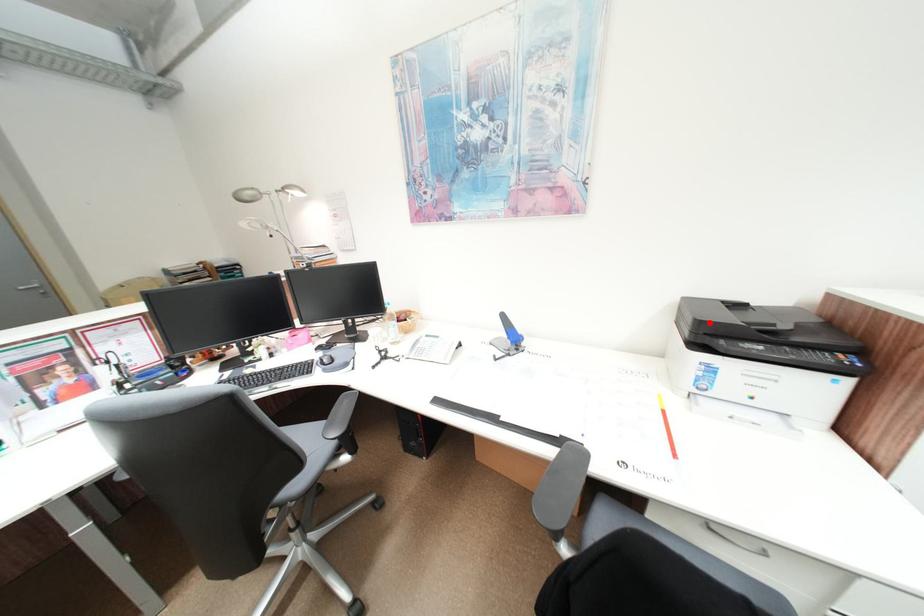
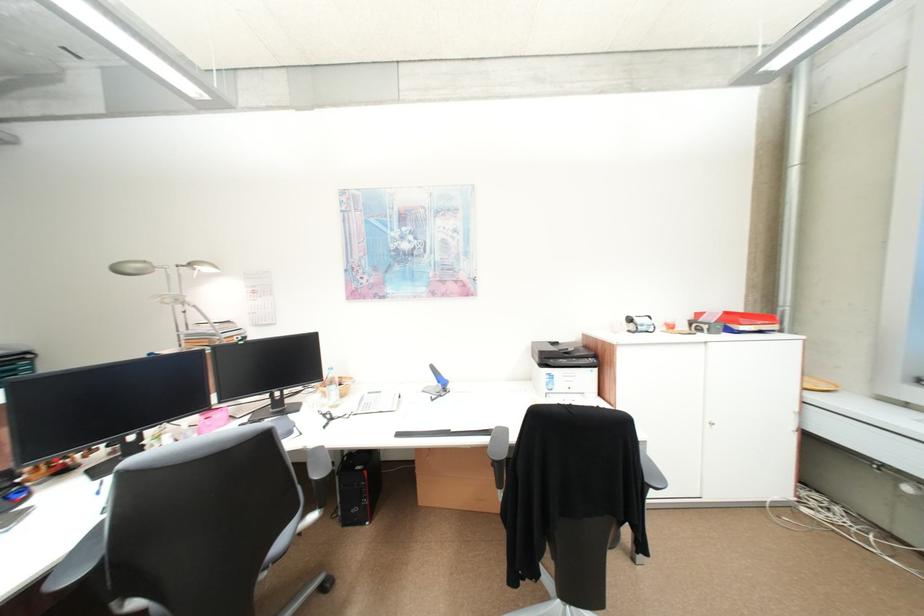
In the second image, find the point that corresponds to the highlighted location in the first image.

(551, 353)